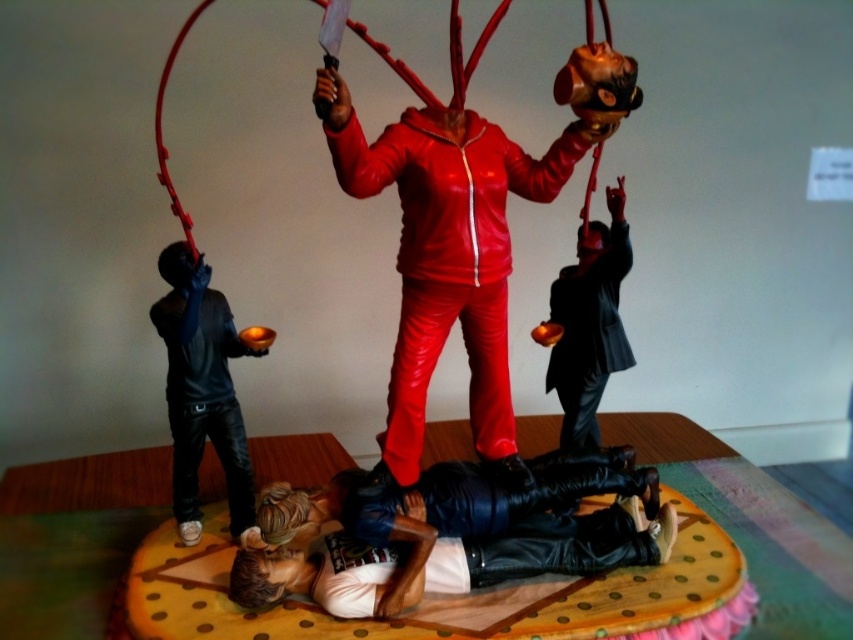
Is leather jacket at lower center to the right of matte black suit at center from the viewer's perspective?

Incorrect, leather jacket at lower center is not on the right side of matte black suit at center.

Can you confirm if leather jacket at lower center is positioned below matte black suit at center?

Yes, leather jacket at lower center is below matte black suit at center.

Image resolution: width=853 pixels, height=640 pixels. I want to click on leather jacket at lower center, so click(548, 548).

Between point (231, 502) and point (602, 260), which one is positioned in front?

Point (231, 502)

Which of these two, black leather jacket at left or matte black suit at center, stands taller?

black leather jacket at left is taller.

Is point (183, 506) closer to camera compared to point (587, 305)?

Yes, point (183, 506) is closer to viewer.

Identify the location of black leather jacket at left. Image resolution: width=853 pixels, height=640 pixels. (202, 392).

Does leather jacket at lower center have a greater width compared to black leather jacket at left?

Indeed, leather jacket at lower center has a greater width compared to black leather jacket at left.

Is leather jacket at lower center closer to the viewer compared to black leather jacket at left?

Yes, leather jacket at lower center is closer to the viewer.

Locate an element on the screen. Image resolution: width=853 pixels, height=640 pixels. leather jacket at lower center is located at coordinates (548, 548).